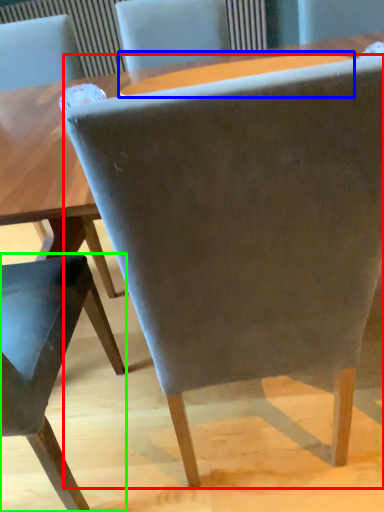
Question: Which object is positioned closest to chair (highlighted by a red box)? Select from round table (highlighted by a blue box) and chair (highlighted by a green box).

Choices:
 (A) round table
 (B) chair

Answer: (B)